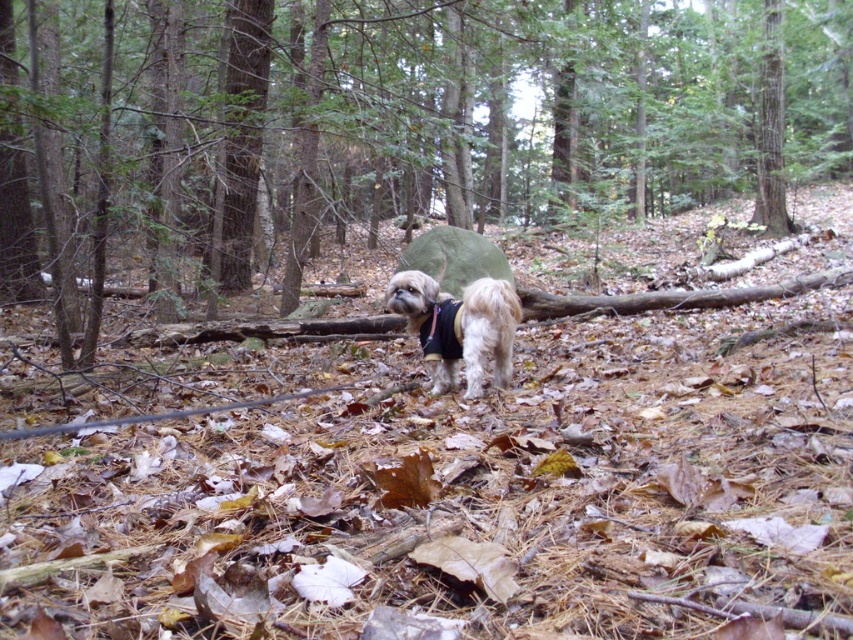
Based on the photo, you are planning to take the fuzzy white dog at center into the green matte tent at center for shelter from an incoming rain shower. Based on their sizes, will the tent accommodate the dog comfortably?

The green matte tent at center is wider than the fuzzy white dog at center, so it should comfortably accommodate the dog with enough space.

You are planning to set up a tent in this forest area. You have a green matte tent at center and a fuzzy white dog at center. Which object is taller and needs to be considered for clearance when choosing a camping spot?

The green matte tent at center is taller than the fuzzy white dog at center, so you should consider the height of the green matte tent at center when choosing a camping spot for clearance.